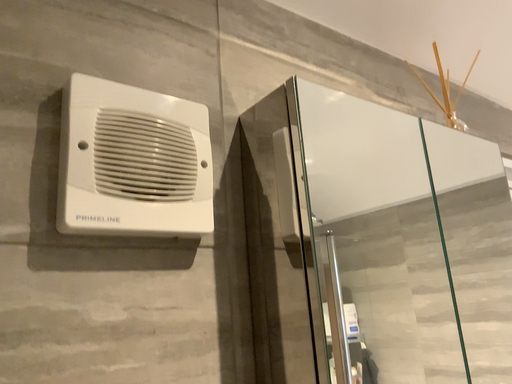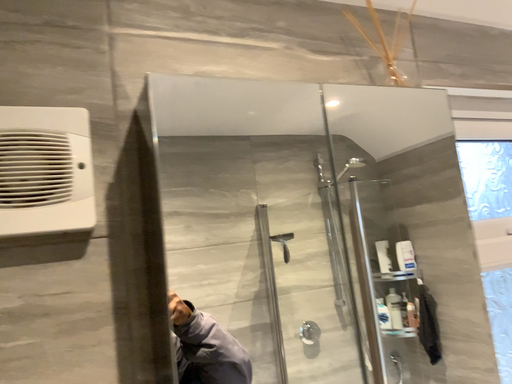
Question: How did the camera likely rotate when shooting the video?

Choices:
 (A) rotated left
 (B) rotated right

Answer: (A)